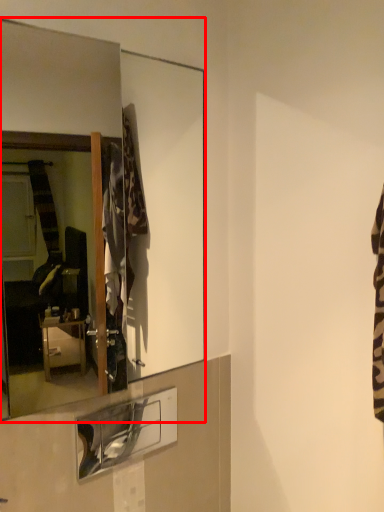
Question: From the image's perspective, what is the correct spatial positioning of mirror (annotated by the red box) in reference to shelf?

Choices:
 (A) below
 (B) above

Answer: (B)